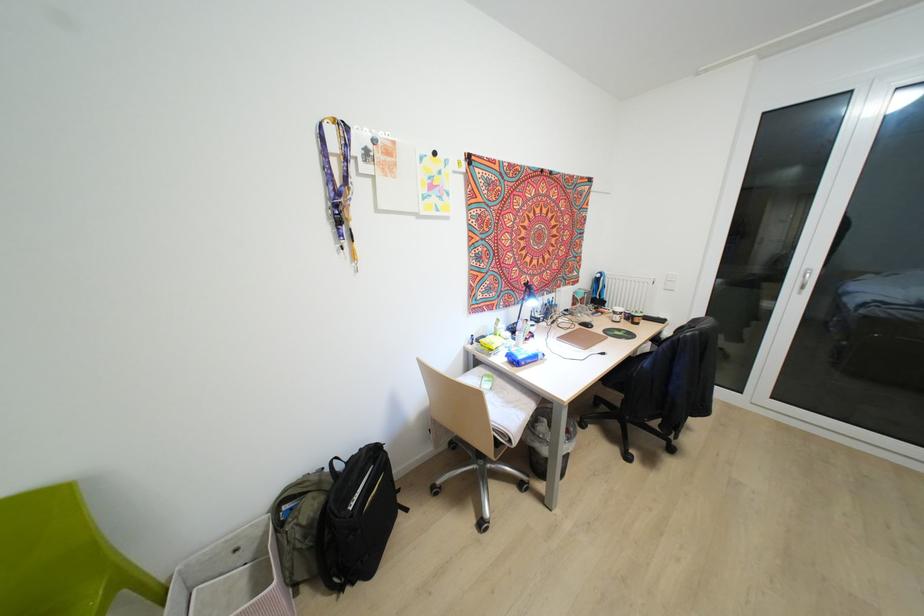
Which object does [525,302] point to?

It refers to a black desk lamp.